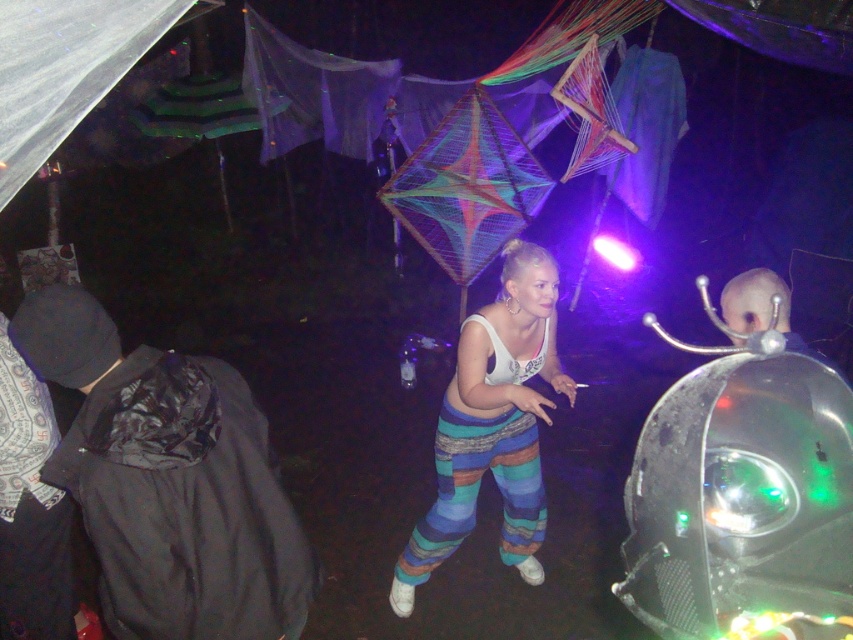
Can you confirm if black plastic bag at lower left is shorter than white cotton tank top at center?

Indeed, black plastic bag at lower left has a lesser height compared to white cotton tank top at center.

At what (x,y) coordinates should I click in order to perform the action: click on black plastic bag at lower left. Please return your answer as a coordinate pair (x, y). Looking at the image, I should click on (167, 481).